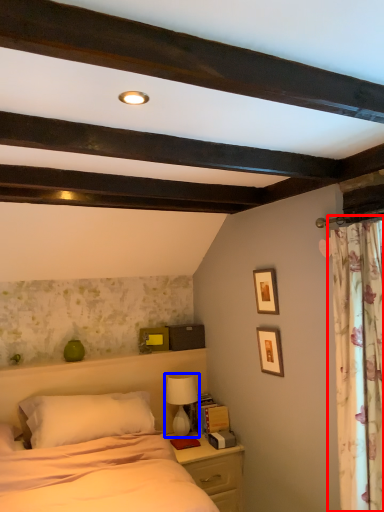
Question: Which of the following is the farthest to the observer, curtain (highlighted by a red box) or table lamp (highlighted by a blue box)?

Choices:
 (A) curtain
 (B) table lamp

Answer: (B)